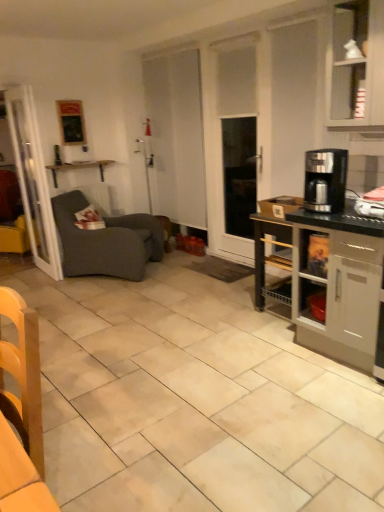
Question: From the image's perspective, is dark gray fabric studio couch at left on wooden chair at lower left?

Choices:
 (A) no
 (B) yes

Answer: (B)

Question: Can you confirm if dark gray fabric studio couch at left is taller than wooden chair at lower left?

Choices:
 (A) yes
 (B) no

Answer: (B)

Question: Is dark gray fabric studio couch at left to the right of wooden chair at lower left from the viewer's perspective?

Choices:
 (A) no
 (B) yes

Answer: (A)

Question: Does dark gray fabric studio couch at left have a lesser width compared to wooden chair at lower left?

Choices:
 (A) yes
 (B) no

Answer: (B)

Question: Is the depth of dark gray fabric studio couch at left less than that of wooden chair at lower left?

Choices:
 (A) yes
 (B) no

Answer: (B)

Question: Is dark gray fabric studio couch at left outside wooden chair at lower left?

Choices:
 (A) no
 (B) yes

Answer: (B)

Question: Is wooden chair at lower left far away from wooden shelf at upper left?

Choices:
 (A) no
 (B) yes

Answer: (B)

Question: Is wooden chair at lower left to the right of wooden shelf at upper left from the viewer's perspective?

Choices:
 (A) yes
 (B) no

Answer: (A)

Question: Is wooden chair at lower left bigger than wooden shelf at upper left?

Choices:
 (A) no
 (B) yes

Answer: (B)

Question: Does wooden chair at lower left turn towards wooden shelf at upper left?

Choices:
 (A) yes
 (B) no

Answer: (B)

Question: Does wooden chair at lower left have a lesser width compared to wooden shelf at upper left?

Choices:
 (A) yes
 (B) no

Answer: (A)

Question: Is wooden chair at lower left closer to camera compared to wooden shelf at upper left?

Choices:
 (A) yes
 (B) no

Answer: (A)

Question: Is satin black coffee maker at right far from wooden shelf at upper left?

Choices:
 (A) yes
 (B) no

Answer: (A)